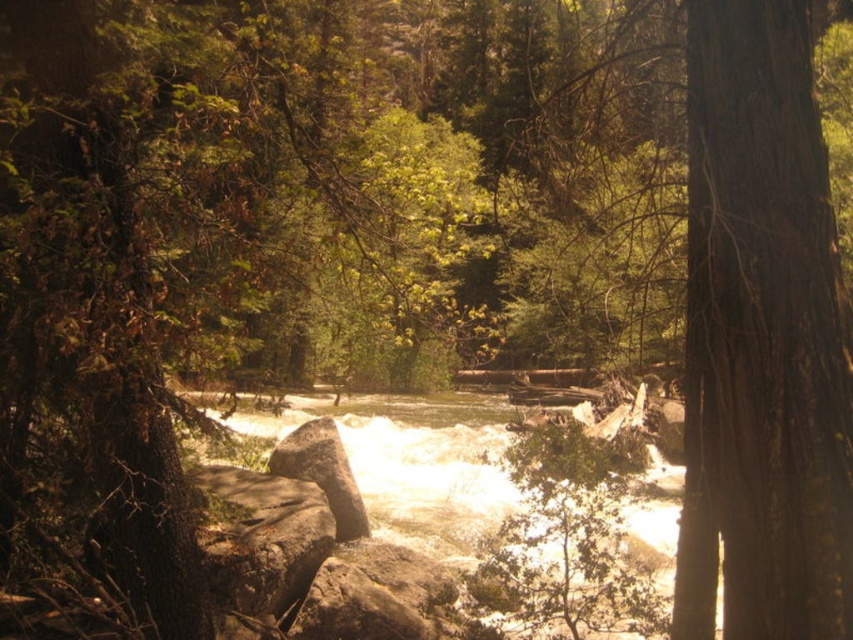
You are a hiker trying to cross the river. You see the smooth brown tree trunk at right and the white frothy water at center. Which object is closer to the left side of the river?

The white frothy water at center is closer to the left side of the river because the smooth brown tree trunk at right is positioned on the right side of it.

You are a hiker who wants to cross the river using the rocks as stepping stones. The smooth brown tree trunk at right and the rough textured rock at center are 3.81 meters apart. Can you safely jump between them if your maximum jumping distance is 3 meters?

The smooth brown tree trunk at right and rough textured rock at center are 3.81 meters apart, which exceeds your maximum jumping distance of 3 meters. Therefore, it is not safe to jump between them.